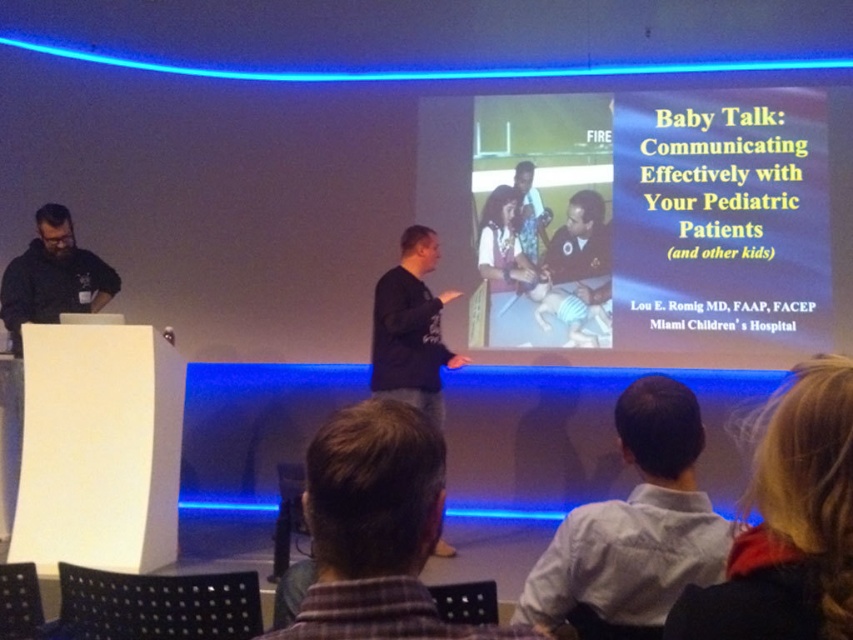
Question: Which object is positioned farthest from the white matte projector screen at center?

Choices:
 (A) blonde hair at upper right
 (B) brown plaid shirt at lower center
 (C) white shirt at lower center

Answer: (A)

Question: Is the position of black matte shirt at center less distant than that of dark brown beard at left?

Choices:
 (A) no
 (B) yes

Answer: (B)

Question: Considering the real-world distances, which object is closest to the brown plaid shirt at lower center?

Choices:
 (A) blonde hair at upper right
 (B) white shirt at lower center
 (C) white matte projector screen at center

Answer: (A)

Question: Does white matte projector screen at center have a greater width compared to blonde hair at upper right?

Choices:
 (A) no
 (B) yes

Answer: (B)

Question: In this image, where is black matte shirt at center located relative to dark brown beard at left?

Choices:
 (A) right
 (B) left

Answer: (A)

Question: Which point is farther to the camera?

Choices:
 (A) blonde hair at upper right
 (B) brown plaid shirt at lower center
 (C) white matte projector screen at center
 (D) white shirt at lower center

Answer: (C)